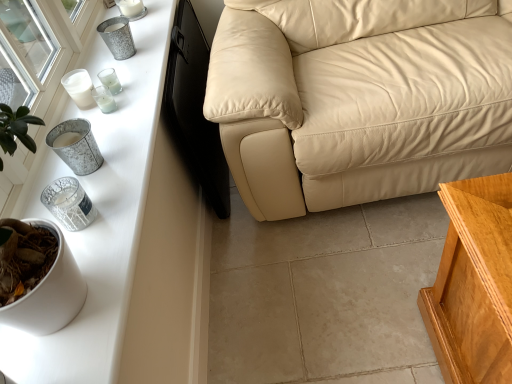
Locate an element on the screen. This screenshot has width=512, height=384. free space behind metallic glass candle holder at upper left, the fifth candle holder when ordered from bottom to top is located at coordinates (122, 69).